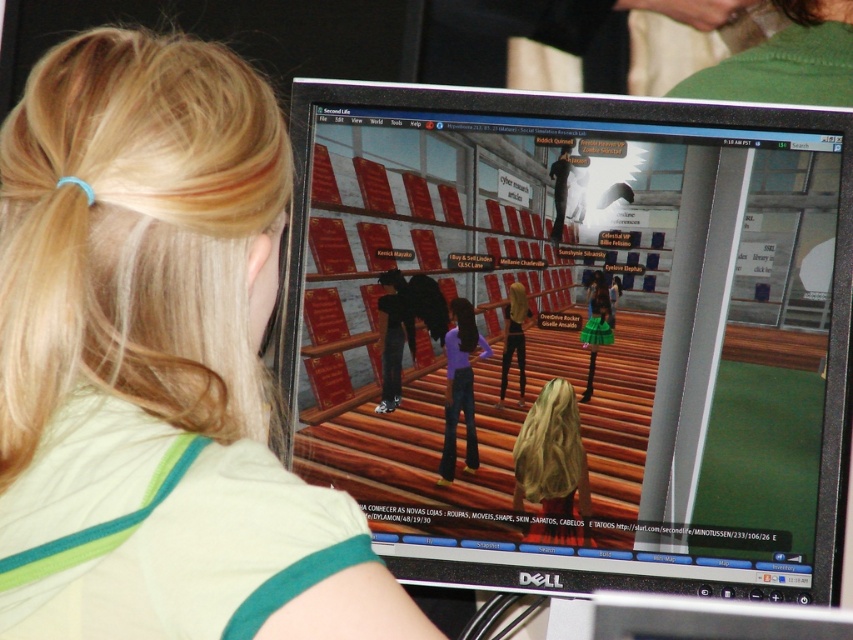
Is blonde hair at upper left above purple denim jeans at center?

Yes.

Locate an element on the screen. The image size is (853, 640). blonde hair at upper left is located at coordinates (163, 349).

Does wooden floor at center appear under blonde hair at upper left?

No.

What do you see at coordinates (577, 332) in the screenshot? This screenshot has height=640, width=853. I see `wooden floor at center` at bounding box center [577, 332].

Where is `wooden floor at center`? The height and width of the screenshot is (640, 853). wooden floor at center is located at coordinates (577, 332).

Can you confirm if wooden floor at center is bigger than purple denim jeans at center?

Yes, wooden floor at center is bigger than purple denim jeans at center.

Measure the distance between point (x=683, y=440) and camera.

Point (x=683, y=440) and camera are 1.22 meters apart.

Is point (751, 552) more distant than point (474, 440)?

No, (751, 552) is in front of (474, 440).

In order to click on wooden floor at center in this screenshot , I will do `click(577, 332)`.